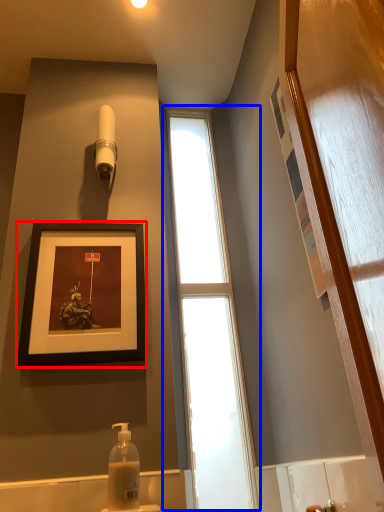
Question: Which object is closer to the camera taking this photo, picture frame (highlighted by a red box) or window (highlighted by a blue box)?

Choices:
 (A) picture frame
 (B) window

Answer: (A)